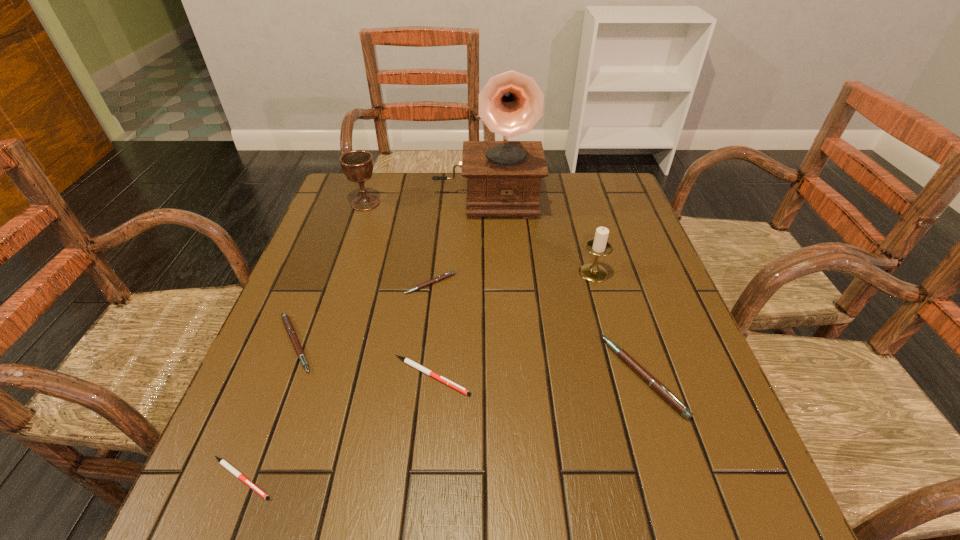
Find the location of a particular element. brown record player is located at coordinates (504, 177).

Where is `record player`? The height and width of the screenshot is (540, 960). record player is located at coordinates (504, 177).

Identify the location of chalice. This screenshot has width=960, height=540. (357, 165).

The image size is (960, 540). Identify the location of candle holder. (599, 246).

Identify the location of the rightmost pink pen. The image size is (960, 540). (655, 384).

Locate an element on the screen. This screenshot has width=960, height=540. the tallest pen is located at coordinates (655, 384).

Locate an element on the screen. the second smallest pink pen is located at coordinates (288, 325).

Where is `the leftmost pink pen`? the leftmost pink pen is located at coordinates (288, 325).

Locate an element on the screen. Image resolution: width=960 pixels, height=540 pixels. the farthest pen is located at coordinates (450, 273).

Find the location of a particular element. The width and height of the screenshot is (960, 540). the smallest pink pen is located at coordinates (450, 273).